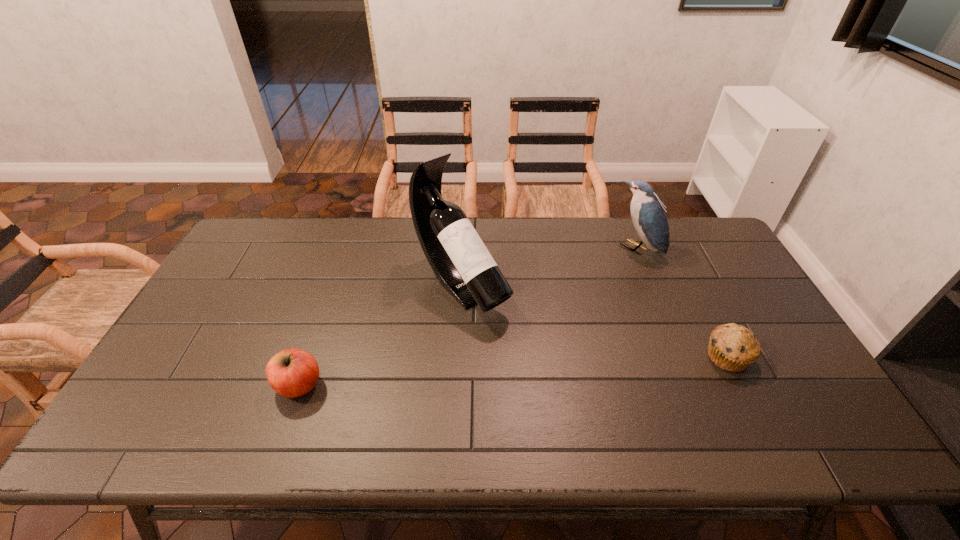
Locate an element on the screen. vacant region at the right edge of the desktop is located at coordinates (733, 265).

Where is `free space at the far left corner`? free space at the far left corner is located at coordinates (249, 234).

Identify the location of free space at the far right corner of the desktop. (715, 246).

This screenshot has height=540, width=960. Identify the location of free spot between the wine bottle and the muffin. (594, 321).

Locate an element on the screen. This screenshot has width=960, height=540. free space between the apple and the muffin is located at coordinates click(x=513, y=371).

Identify the location of free spot between the leftmost object and the muffin. This screenshot has width=960, height=540. (513, 371).

Where is `vacant space that's between the shortest object and the second shortest object`? The height and width of the screenshot is (540, 960). vacant space that's between the shortest object and the second shortest object is located at coordinates (513, 371).

Find the location of a particular element. free point between the second tallest object and the tallest object is located at coordinates (549, 267).

Find the location of `free space between the tallest object and the leftmost object`. free space between the tallest object and the leftmost object is located at coordinates (380, 335).

Locate an element on the screen. free space between the second object from left to right and the second tallest object is located at coordinates (549, 267).